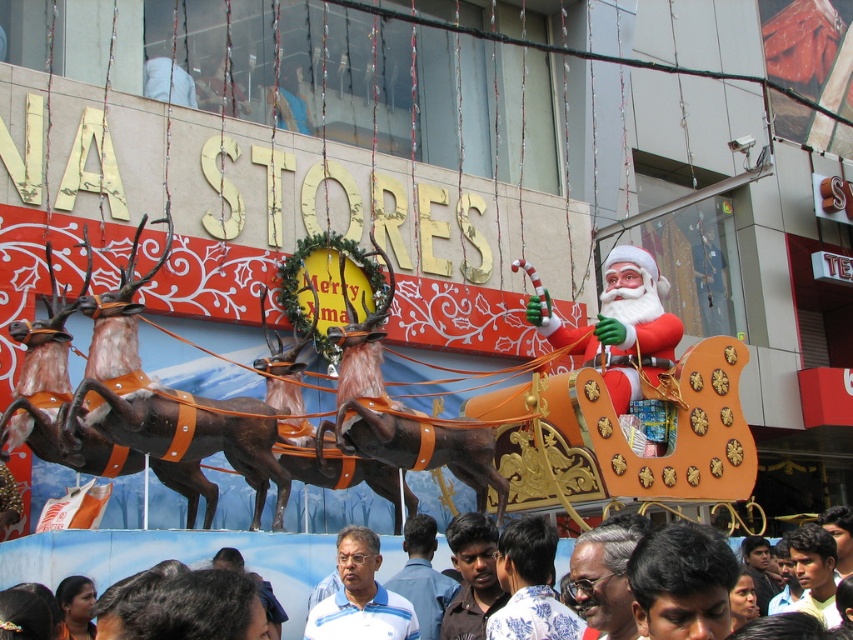
Does floral shirt at center appear on the right side of light brown hair at lower right?

In fact, floral shirt at center is to the left of light brown hair at lower right.

Describe the element at coordinates (531, 586) in the screenshot. I see `floral shirt at center` at that location.

Identify the location of floral shirt at center. This screenshot has width=853, height=640. tap(531, 586).

Which is more to the right, red glossy santa claus at center or blue shirt at center?

From the viewer's perspective, red glossy santa claus at center appears more on the right side.

Does red glossy santa claus at center appear under blue shirt at center?

No.

Does point (621, 384) come behind point (415, 566)?

That is True.

Where is `red glossy santa claus at center`? red glossy santa claus at center is located at coordinates (624, 337).

What do you see at coordinates (624, 337) in the screenshot? Image resolution: width=853 pixels, height=640 pixels. I see `red glossy santa claus at center` at bounding box center [624, 337].

Is red glossy santa claus at center to the right of light brown hair at lower right from the viewer's perspective?

In fact, red glossy santa claus at center is to the left of light brown hair at lower right.

Between point (628, 316) and point (822, 577), which one is positioned in front?

Point (822, 577) is in front.

The image size is (853, 640). I want to click on red glossy santa claus at center, so click(x=624, y=337).